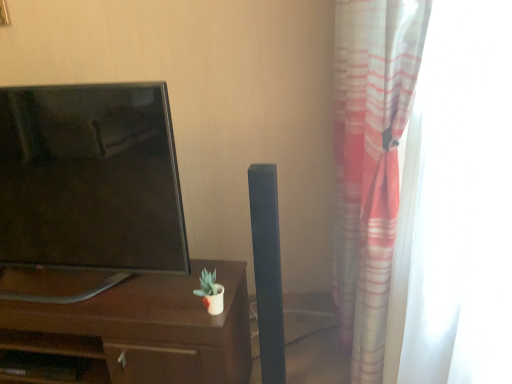
Question: Would you consider translucent fabric curtain at right to be distant from brown wood desk at center?

Choices:
 (A) yes
 (B) no

Answer: (B)

Question: Is brown wood desk at center located within translucent fabric curtain at right?

Choices:
 (A) yes
 (B) no

Answer: (B)

Question: Is translucent fabric curtain at right taller than brown wood desk at center?

Choices:
 (A) yes
 (B) no

Answer: (A)

Question: Considering the relative sizes of translucent fabric curtain at right and brown wood desk at center in the image provided, is translucent fabric curtain at right shorter than brown wood desk at center?

Choices:
 (A) no
 (B) yes

Answer: (A)

Question: Is translucent fabric curtain at right turned away from brown wood desk at center?

Choices:
 (A) no
 (B) yes

Answer: (A)

Question: Is translucent fabric curtain at right outside of brown wood desk at center?

Choices:
 (A) yes
 (B) no

Answer: (A)

Question: Is matte black tv at left shorter than translucent fabric curtain at right?

Choices:
 (A) no
 (B) yes

Answer: (B)

Question: Is matte black tv at left oriented towards translucent fabric curtain at right?

Choices:
 (A) no
 (B) yes

Answer: (A)

Question: From the image's perspective, would you say matte black tv at left is positioned over translucent fabric curtain at right?

Choices:
 (A) yes
 (B) no

Answer: (A)

Question: Can you confirm if matte black tv at left is positioned to the right of translucent fabric curtain at right?

Choices:
 (A) no
 (B) yes

Answer: (A)

Question: From a real-world perspective, is matte black tv at left located higher than translucent fabric curtain at right?

Choices:
 (A) yes
 (B) no

Answer: (A)

Question: Is translucent fabric curtain at right located within matte black tv at left?

Choices:
 (A) no
 (B) yes

Answer: (A)

Question: Is the depth of brown wood desk at center greater than that of translucent fabric curtain at right?

Choices:
 (A) no
 (B) yes

Answer: (B)